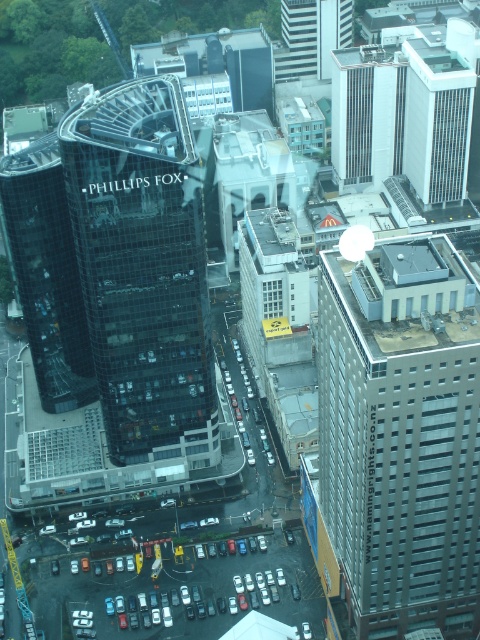
Identify the location of shiny glass building at center-left. (47, 273).

Between point (87, 333) and point (345, 35), which one is positioned in front?

Positioned in front is point (87, 333).

At what (x,y) coordinates should I click in order to perform the action: click on shiny glass building at center-left. Please return your answer as a coordinate pair (x, y). This screenshot has height=640, width=480. Looking at the image, I should click on (47, 273).

Is white glass skyscraper at upper right above gray concrete building at center?

No, white glass skyscraper at upper right is not above gray concrete building at center.

Between point (432, 67) and point (393, 74), which one is positioned in front?

Positioned in front is point (432, 67).

Which is behind, point (425, 60) or point (396, 150)?

The point (396, 150) is more distant.

Locate an element on the screen. This screenshot has width=480, height=640. white glass skyscraper at upper right is located at coordinates (439, 115).

Does point (345, 374) come farther from viewer compared to point (62, 227)?

No.

Is point (383, 340) closer to viewer compared to point (43, 166)?

Yes, it is in front of point (43, 166).

Locate an element on the screen. The height and width of the screenshot is (640, 480). metallic silver building at upper right is located at coordinates (402, 435).